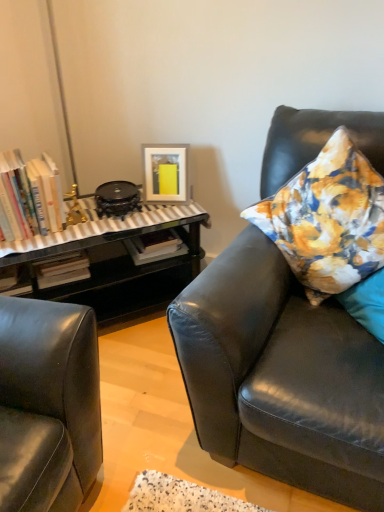
Question: Is matte white picture frame at upper center behind floral fabric pillow at right?

Choices:
 (A) yes
 (B) no

Answer: (A)

Question: Is matte white picture frame at upper center facing away from floral fabric pillow at right?

Choices:
 (A) no
 (B) yes

Answer: (A)

Question: Can you confirm if matte white picture frame at upper center is taller than floral fabric pillow at right?

Choices:
 (A) no
 (B) yes

Answer: (A)

Question: Does matte white picture frame at upper center have a lesser width compared to floral fabric pillow at right?

Choices:
 (A) no
 (B) yes

Answer: (B)

Question: From the image's perspective, is matte white picture frame at upper center on top of floral fabric pillow at right?

Choices:
 (A) yes
 (B) no

Answer: (A)

Question: From their relative heights in the image, would you say hardcover books at left is taller or shorter than matte black leather couch at right?

Choices:
 (A) short
 (B) tall

Answer: (A)

Question: Choose the correct answer: Is hardcover books at left inside matte black leather couch at right or outside it?

Choices:
 (A) outside
 (B) inside

Answer: (A)

Question: Does point (36, 173) appear closer or farther from the camera than point (279, 478)?

Choices:
 (A) farther
 (B) closer

Answer: (A)

Question: Looking at their shapes, would you say hardcover books at left is wider or thinner than matte black leather couch at right?

Choices:
 (A) wide
 (B) thin

Answer: (B)

Question: Does point (165, 189) appear closer or farther from the camera than point (271, 183)?

Choices:
 (A) closer
 (B) farther

Answer: (B)

Question: In the image, is matte white picture frame at upper center on the left side or the right side of matte black leather couch at right?

Choices:
 (A) left
 (B) right

Answer: (A)

Question: In the image, is matte white picture frame at upper center positioned in front of or behind matte black leather couch at right?

Choices:
 (A) behind
 (B) front

Answer: (A)

Question: Is matte white picture frame at upper center taller or shorter than matte black leather couch at right?

Choices:
 (A) tall
 (B) short

Answer: (B)

Question: From the image's perspective, is hardcover books at left located above or below floral fabric pillow at right?

Choices:
 (A) below
 (B) above

Answer: (B)

Question: Looking at their shapes, would you say hardcover books at left is wider or thinner than floral fabric pillow at right?

Choices:
 (A) wide
 (B) thin

Answer: (B)